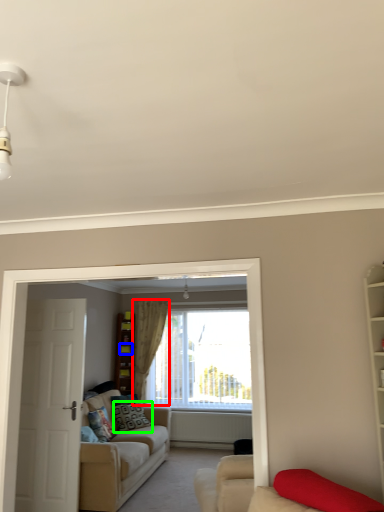
Question: Estimate the real-world distances between objects in this image. Which object is closer to curtain (highlighted by a red box), shelf (highlighted by a blue box) or pillow (highlighted by a green box)?

Choices:
 (A) shelf
 (B) pillow

Answer: (A)